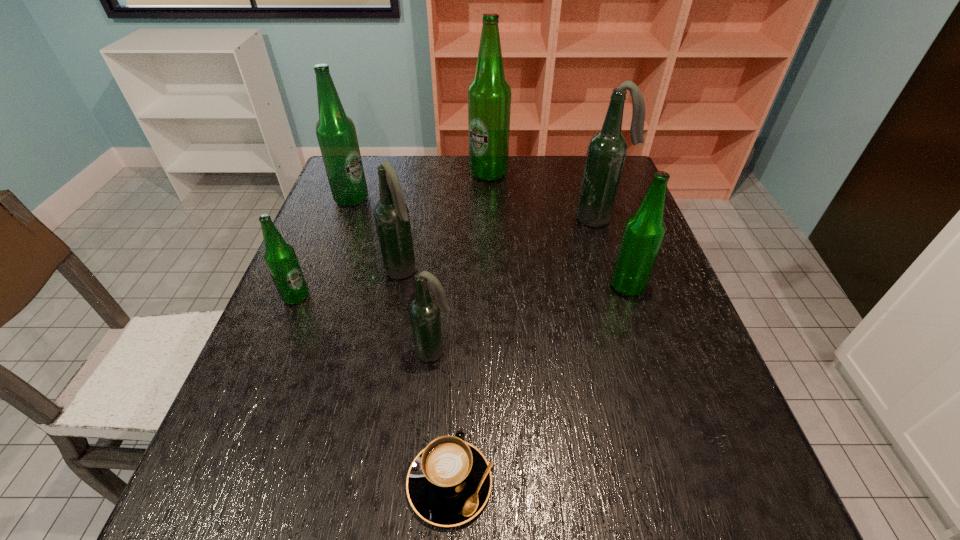
At what (x,y) coordinates should I click in order to perform the action: click on free space between the smallest green beer bottle and the third farthest object. Please return your answer as a coordinate pair (x, y). The height and width of the screenshot is (540, 960). Looking at the image, I should click on (448, 258).

What are the coordinates of `empty location between the smallest green beer bottle and the third farthest beer bottle` in the screenshot? It's located at (448, 258).

Image resolution: width=960 pixels, height=540 pixels. Identify the location of free space between the black cappuccino and the second biggest dark beer bottle. (426, 377).

Where is `the fifth closest object to the second nearest dark beer bottle`? The height and width of the screenshot is (540, 960). the fifth closest object to the second nearest dark beer bottle is located at coordinates (449, 482).

This screenshot has width=960, height=540. Identify the location of object that stands as the sixth closest to the shortest object. (336, 133).

You are a GUI agent. You are given a task and a screenshot of the screen. Output one action in this format:
    pyautogui.click(x=<x>, y=<y>)
    Task: Click on the beer bottle that stands as the second closest to the cappuccino
    The height and width of the screenshot is (540, 960).
    Given the screenshot: What is the action you would take?
    pyautogui.click(x=391, y=215)

Locate which beer bottle ranks in proximity to the nearest dark beer bottle. Please provide its 2D coordinates. Your answer should be formatted as a tuple, i.e. [(x, y)], where the tuple contains the x and y coordinates of a point satisfying the conditions above.

[(391, 215)]

Where is `green beer bottle that is the second closest to the cappuccino`? The height and width of the screenshot is (540, 960). green beer bottle that is the second closest to the cappuccino is located at coordinates (644, 232).

Where is `green beer bottle that is the closest to the third farthest object`? This screenshot has height=540, width=960. green beer bottle that is the closest to the third farthest object is located at coordinates (644, 232).

Image resolution: width=960 pixels, height=540 pixels. In order to click on the second closest dark beer bottle to the farthest beer bottle in this screenshot , I will do `click(391, 215)`.